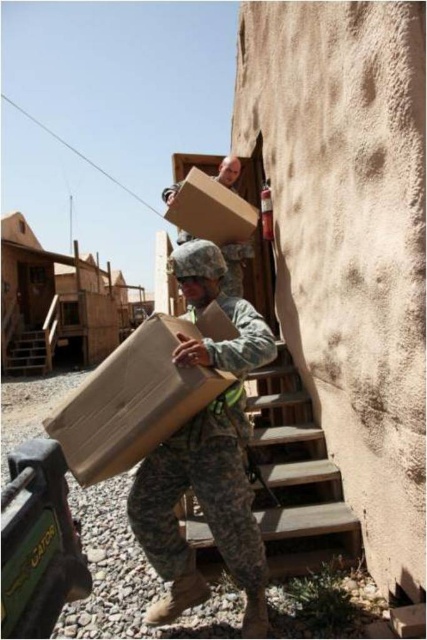
Question: Which of the following is the closest to the observer?

Choices:
 (A) camouflage uniform at center
 (B) brown cardboard box at center
 (C) camouflage fabric soldier at center
 (D) concrete stairs at center

Answer: (B)

Question: Does brown cardboard box at center lie behind camouflage uniform at center?

Choices:
 (A) no
 (B) yes

Answer: (A)

Question: Which of these objects is positioned farthest from the camouflage uniform at center?

Choices:
 (A) brown cardboard box at center
 (B) concrete stairs at center

Answer: (A)

Question: Does camouflage fabric soldier at center have a greater width compared to concrete stairs at center?

Choices:
 (A) yes
 (B) no

Answer: (A)

Question: Which object is positioned farthest from the brown cardboard box at center?

Choices:
 (A) concrete stairs at center
 (B) camouflage fabric soldier at center

Answer: (A)

Question: Is concrete stairs at center in front of camouflage uniform at center?

Choices:
 (A) yes
 (B) no

Answer: (A)